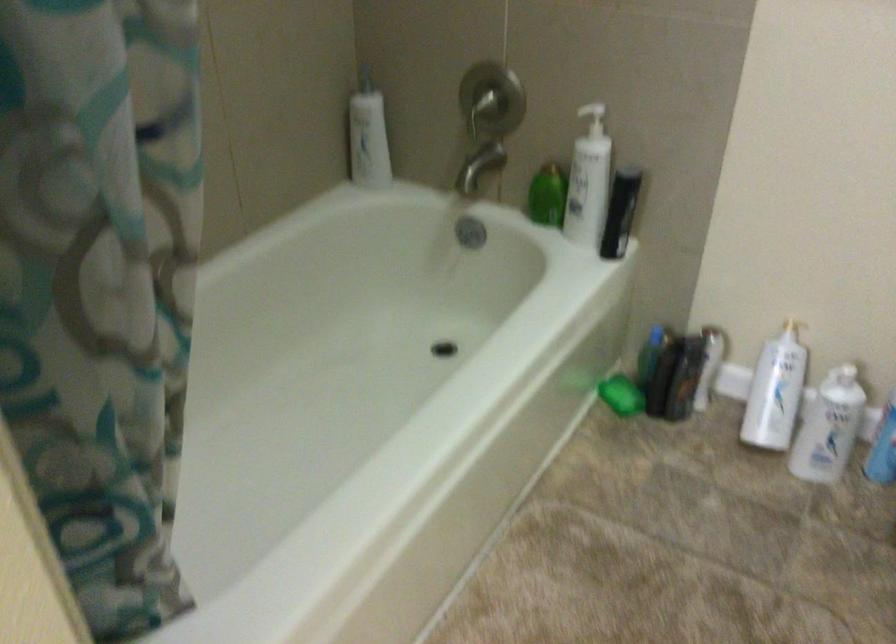
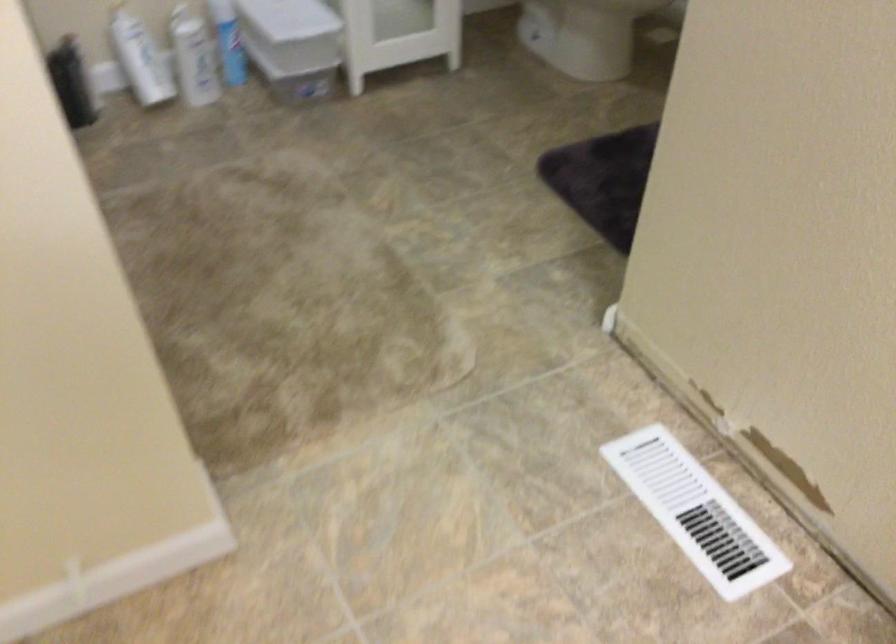
Find the pixel in the second image that matches pixel 659 377 in the first image.

(72, 82)